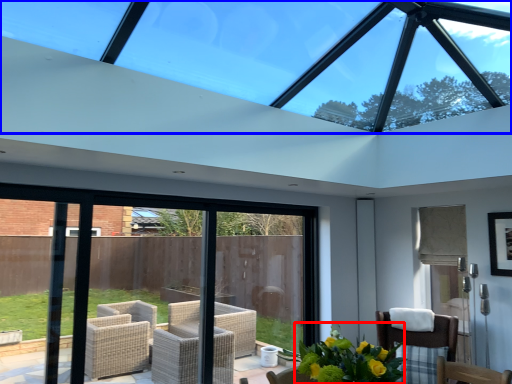
Question: Which point is further to the camera, floral arrangement (highlighted by a red box) or window (highlighted by a blue box)?

Choices:
 (A) floral arrangement
 (B) window

Answer: (A)